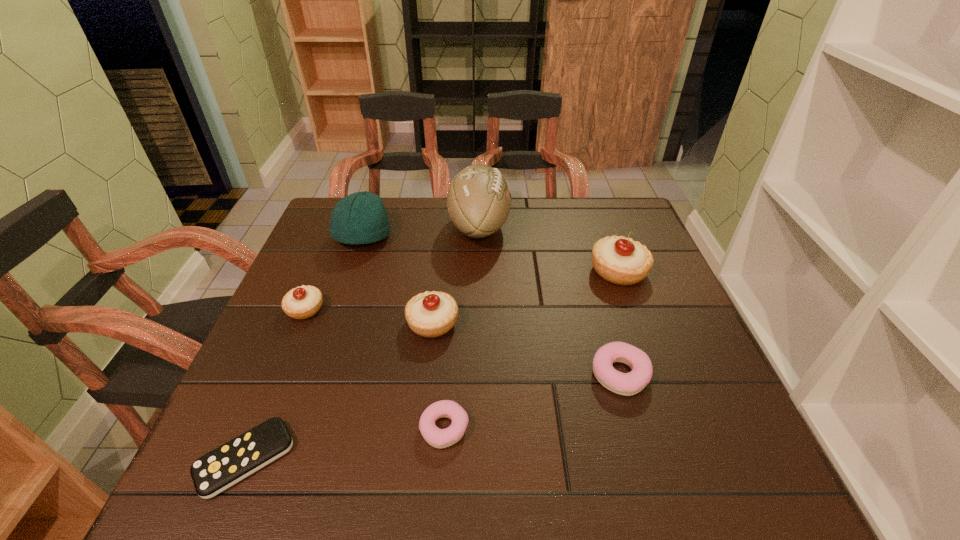
The width and height of the screenshot is (960, 540). What are the coordinates of `the tallest object` in the screenshot? It's located at (478, 200).

At what (x,y) coordinates should I click in order to perform the action: click on beanie. Please return your answer as a coordinate pair (x, y). Image resolution: width=960 pixels, height=540 pixels. Looking at the image, I should click on (360, 218).

Locate an element on the screen. The width and height of the screenshot is (960, 540). the tallest pastry is located at coordinates (622, 261).

Where is `the farthest beige pastry`? the farthest beige pastry is located at coordinates (622, 261).

Identify the location of the fifth shortest object. (432, 314).

Where is `the second biggest beige pastry`? the second biggest beige pastry is located at coordinates (432, 314).

This screenshot has height=540, width=960. I want to click on the leftmost beige pastry, so click(x=303, y=302).

Identify the location of the leftmost pastry. The image size is (960, 540). (303, 302).

The height and width of the screenshot is (540, 960). I want to click on the third nearest object, so click(x=627, y=384).

The width and height of the screenshot is (960, 540). Find the location of `the second shortest pastry`. the second shortest pastry is located at coordinates (627, 384).